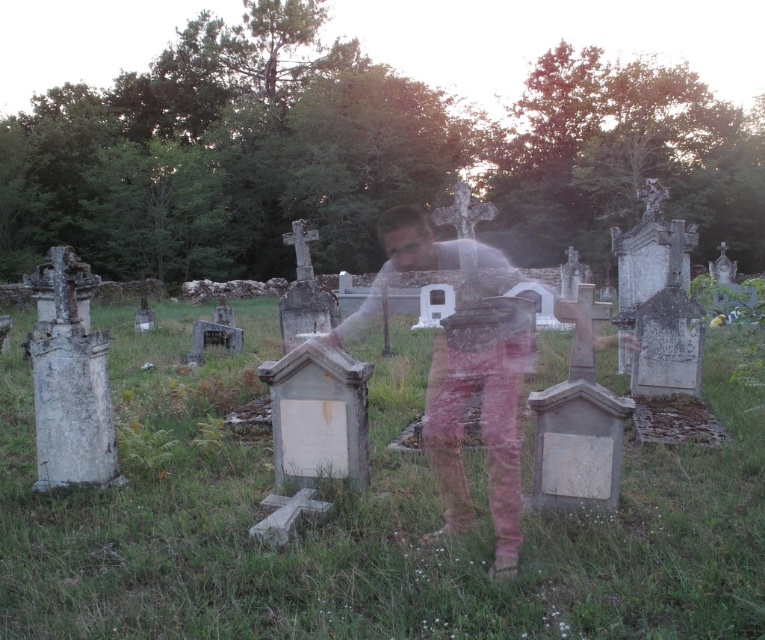
Describe the element at coordinates (360, 522) in the screenshot. I see `white stone tombstones at center` at that location.

Is point (721, 522) farther from camera compared to point (405, 269)?

That is False.

Identify the location of white stone tombstones at center. This screenshot has width=765, height=640. (360, 522).